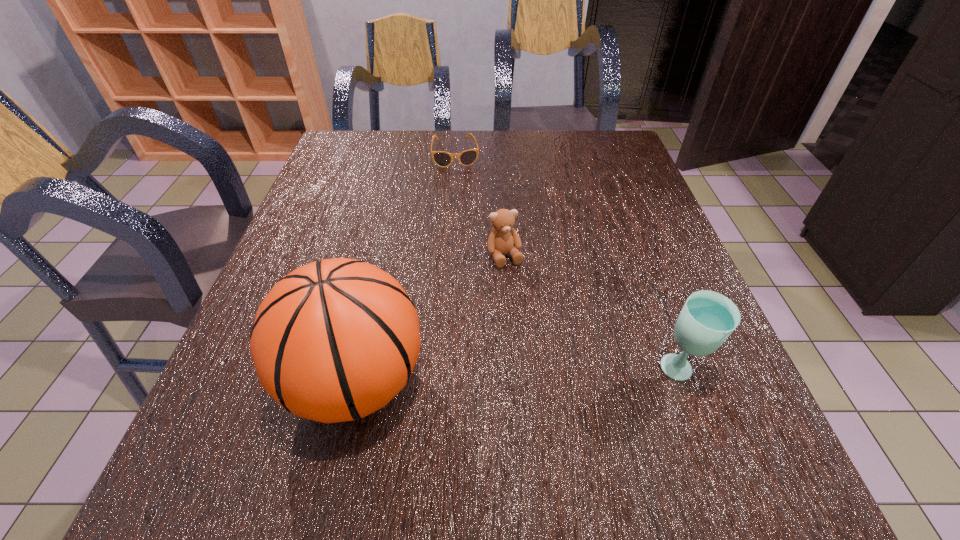
This screenshot has width=960, height=540. In order to click on free point located on the front-facing side of the farthest object in this screenshot , I will do `click(468, 243)`.

The width and height of the screenshot is (960, 540). Find the location of `vacant region located on the front-facing side of the farthest object`. vacant region located on the front-facing side of the farthest object is located at coordinates (470, 254).

Where is `vacant space located 0.240m on the face of the teddy bear`? Image resolution: width=960 pixels, height=540 pixels. vacant space located 0.240m on the face of the teddy bear is located at coordinates (549, 359).

I want to click on blank space located on the face of the teddy bear, so click(x=568, y=402).

Where is `free spot located on the face of the teddy bear`? The image size is (960, 540). free spot located on the face of the teddy bear is located at coordinates (521, 295).

Locate an element on the screen. This screenshot has height=540, width=960. object that is at the far edge is located at coordinates (443, 159).

Where is `basketball that is at the near edge`? The height and width of the screenshot is (540, 960). basketball that is at the near edge is located at coordinates (334, 340).

At what (x,y) coordinates should I click in order to perform the action: click on glass situated at the near edge. Please return your answer as a coordinate pair (x, y). The height and width of the screenshot is (540, 960). Looking at the image, I should click on (707, 318).

Where is `object that is at the left edge`? The width and height of the screenshot is (960, 540). object that is at the left edge is located at coordinates (334, 340).

At what (x,y) coordinates should I click in order to perform the action: click on object situated at the right edge. Please return your answer as a coordinate pair (x, y). Looking at the image, I should click on (707, 318).